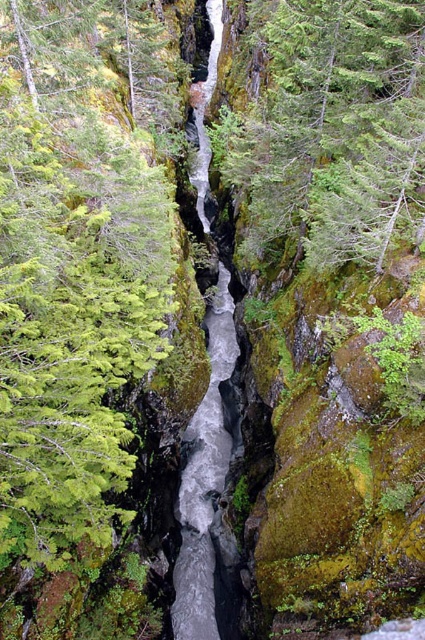
You are standing at the edge of the canyon and want to reach the point marked as point [13,36]. Given that the canyon walls are steep and the river is flowing swiftly, is it possible to safely walk to that point without crossing the river?

The point [13,36] is 16.46 meters away from the camera. However, the steep canyon walls and swift river make it unsafe to walk there without crossing the river, so it is not possible to safely reach that point.